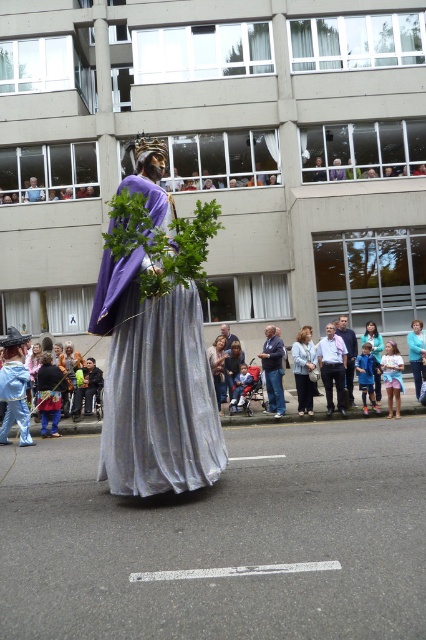
Question: Is blue denim jeans at center to the right of light brown fabric dress at center from the viewer's perspective?

Choices:
 (A) yes
 (B) no

Answer: (A)

Question: Based on their relative distances, which object is farther from the light blue denim dress at center?

Choices:
 (A) blue denim jeans at center
 (B) blue denim jeans at lower right

Answer: (A)

Question: Which object is farther from the camera taking this photo?

Choices:
 (A) blue denim jeans at center
 (B) light brown fabric dress at center
 (C) light blue denim dress at center
 (D) light blue fabric dress at center

Answer: (C)

Question: Among these objects, which one is farthest from the camera?

Choices:
 (A) blue denim jeans at lower right
 (B) light brown fabric dress at center
 (C) silvery metallic dress at center
 (D) light blue denim dress at center

Answer: (D)

Question: Is blue denim jeans at center smaller than light blue denim dress at center?

Choices:
 (A) yes
 (B) no

Answer: (B)

Question: Is light brown fabric dress at center to the left of light blue denim dress at center from the viewer's perspective?

Choices:
 (A) no
 (B) yes

Answer: (B)